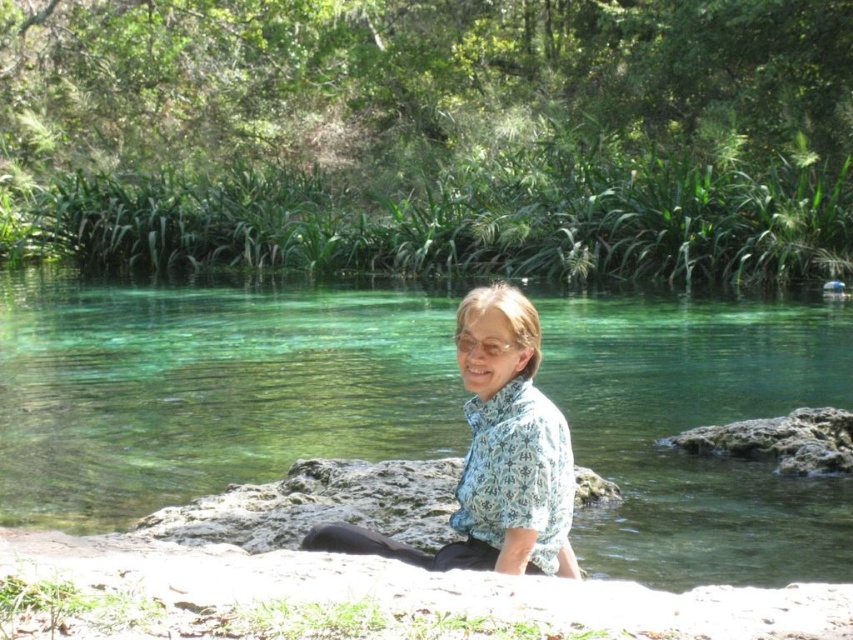
The width and height of the screenshot is (853, 640). In order to click on clear water at center in this screenshot , I will do `click(207, 387)`.

Between clear water at center and blue floral shirt at center, which one has more height?

clear water at center

The image size is (853, 640). Identify the location of clear water at center. (207, 387).

Locate an element on the screen. Image resolution: width=853 pixels, height=640 pixels. clear water at center is located at coordinates (207, 387).